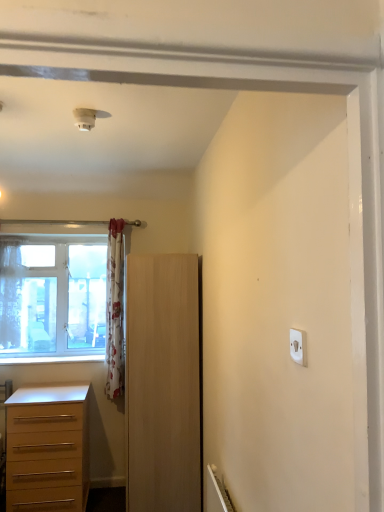
You are a GUI agent. You are given a task and a screenshot of the screen. Output one action in this format:
    pyautogui.click(x=<x>, y=<y>)
    Task: Click on the free point above light brown wooden chest of drawers at lower left (from a real-world perspective)
    The width and height of the screenshot is (384, 512).
    Given the screenshot: What is the action you would take?
    (x=39, y=387)